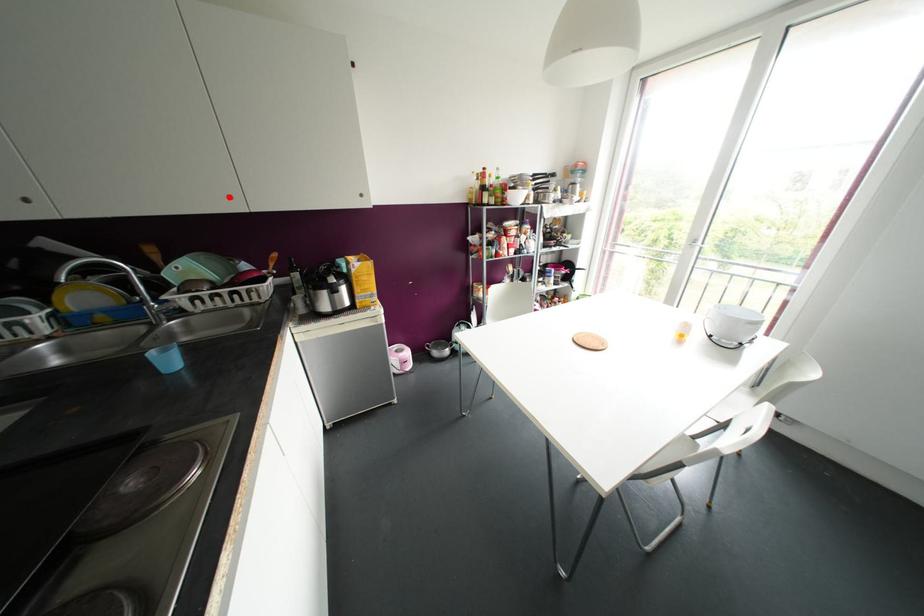
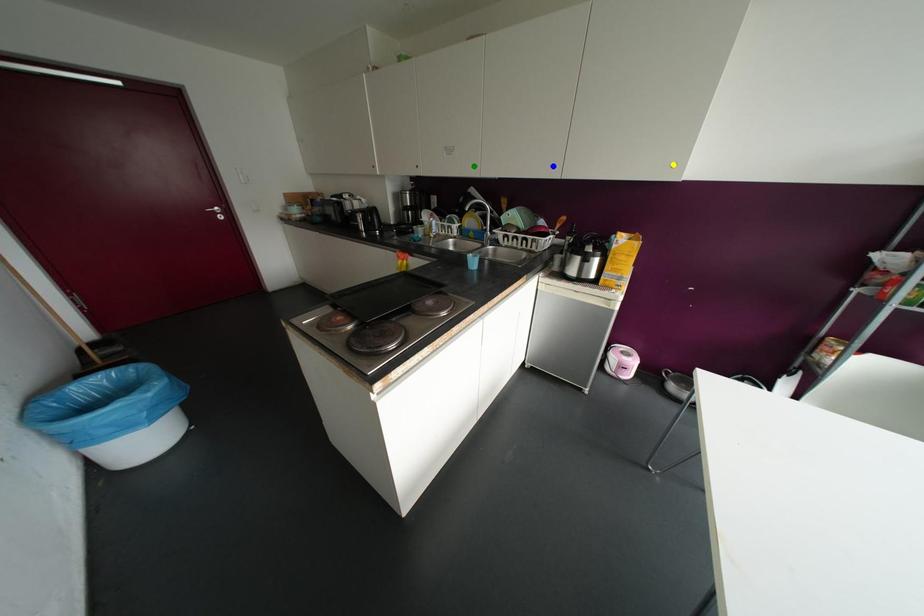
Question: I am providing you with two images of the same scene from different viewpoints. A red point is marked on the first image. You are given multiple points on the second image. Which point in image 2 is actually the same real-world point as the red point in image 1?

Choices:
 (A) blue point
 (B) yellow point
 (C) green point

Answer: (A)